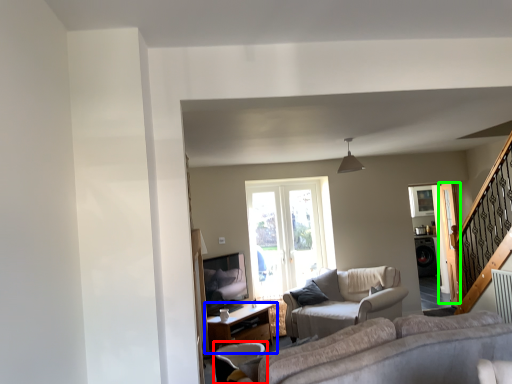
Question: Which is farther away from chair (highlighted by a red box)? table (highlighted by a blue box) or screen door (highlighted by a green box)?

Choices:
 (A) table
 (B) screen door

Answer: (B)